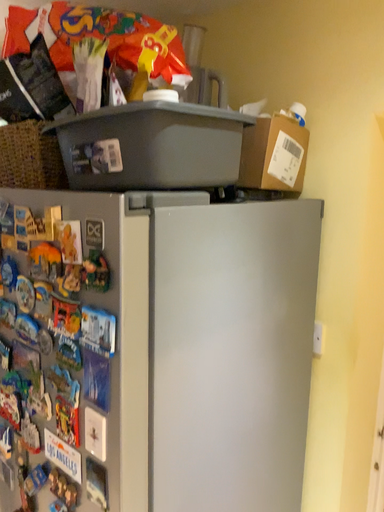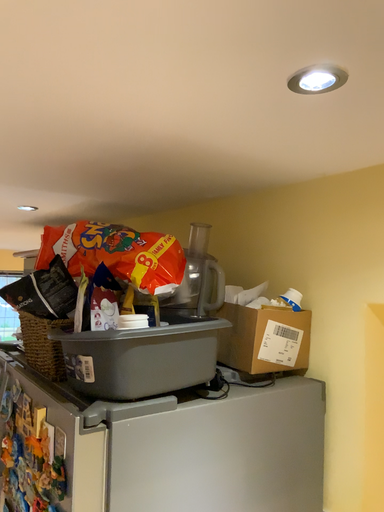
Question: Which way did the camera rotate in the video?

Choices:
 (A) rotated left
 (B) rotated right

Answer: (A)